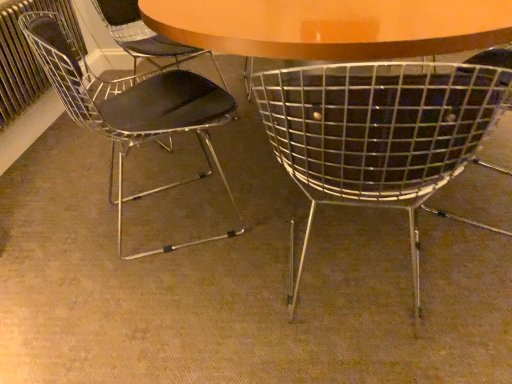
The width and height of the screenshot is (512, 384). I want to click on vacant region to the left of metallic wire chair at left, the 1th chair from the left, so coord(61,223).